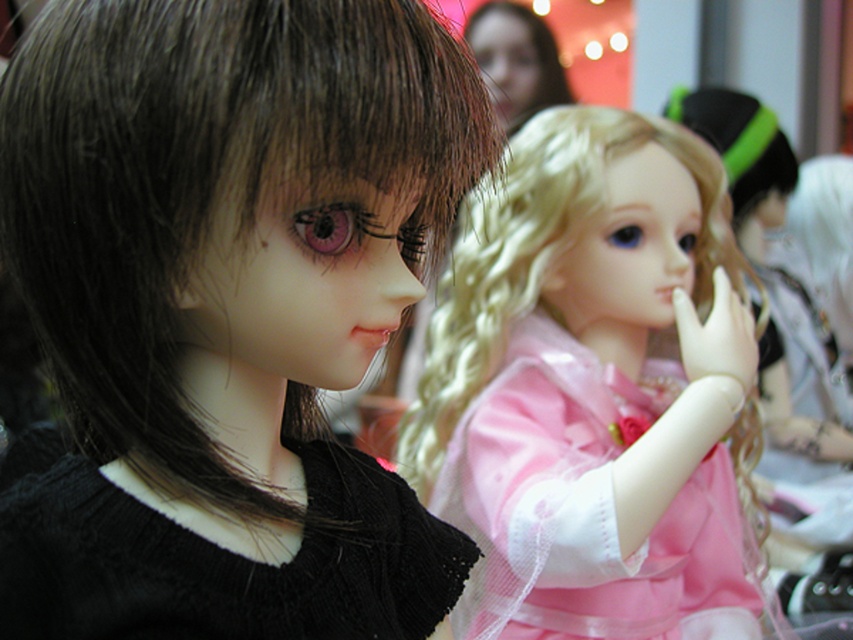
Consider the image. You are a photographer adjusting the lighting for a photo shoot. You need to ensure that the dark brown silky hair at left is properly lit. Where should you position the light source relative to the doll?

To properly light the dark brown silky hair at left, position the light source at point (227, 216) relative to the doll.

You are a photographer trying to capture the two dolls in the image. You want to ensure that the dark brown silky hair at left and the black knitted dress at left are both clearly visible in your photo. Given their height difference, which object might you need to adjust to avoid being obscured?

The dark brown silky hair at left is much taller than the black knitted dress at left, so you might need to lower the dark brown silky hair at left or raise the black knitted dress at left to ensure both are visible without obstruction.

You are a photographer setting up a shoot with two dolls. You have a small shelf that can only hold items up to the size of the black knitted dress at left. Can you place the shiny blonde wig at center on the shelf without it falling off?

The shiny blonde wig at center has a larger size compared to the black knitted dress at left. Since the shelf can only hold items up to the size of the black knitted dress at left, the shiny blonde wig at center is too large to fit on the shelf without falling off.